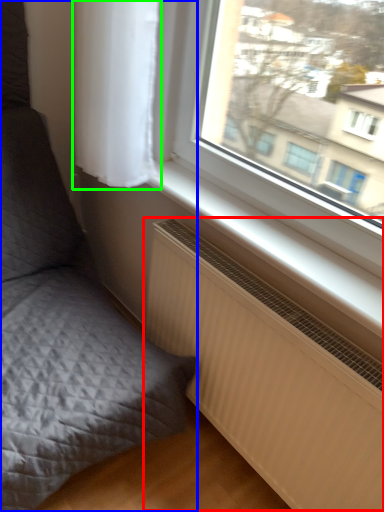
Question: Estimate the real-world distances between objects in this image. Which object is closer to radiator (highlighted by a red box), furniture (highlighted by a blue box) or curtain (highlighted by a green box)?

Choices:
 (A) furniture
 (B) curtain

Answer: (A)